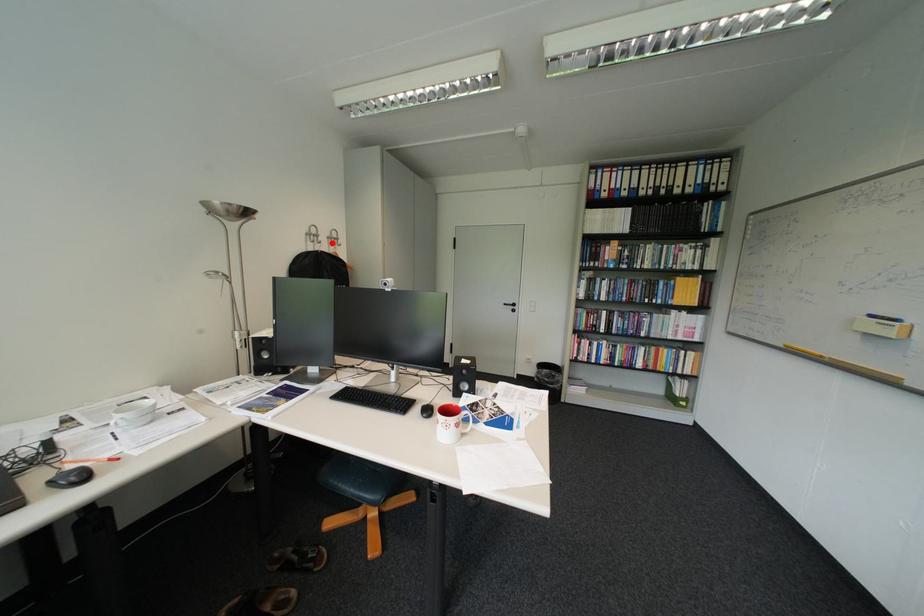
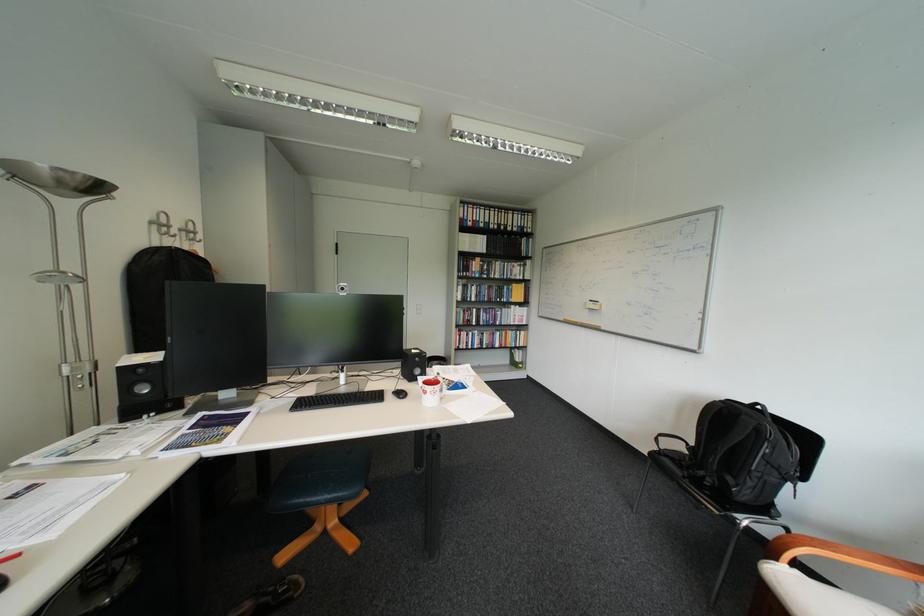
In the second image, find the point that corresponds to the highlighted location in the first image.

(187, 237)